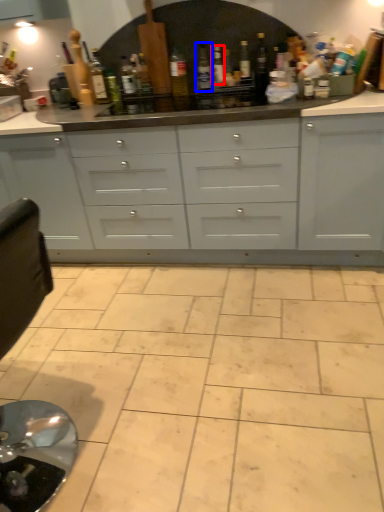
Question: Among these objects, which one is nearest to the camera, bottle (highlighted by a red box) or bottle (highlighted by a blue box)?

Choices:
 (A) bottle
 (B) bottle

Answer: (B)